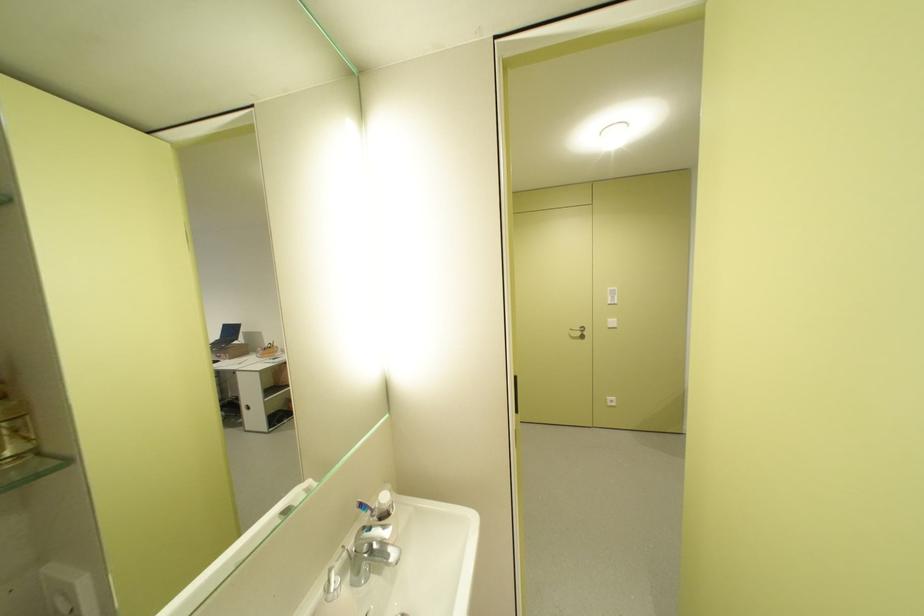
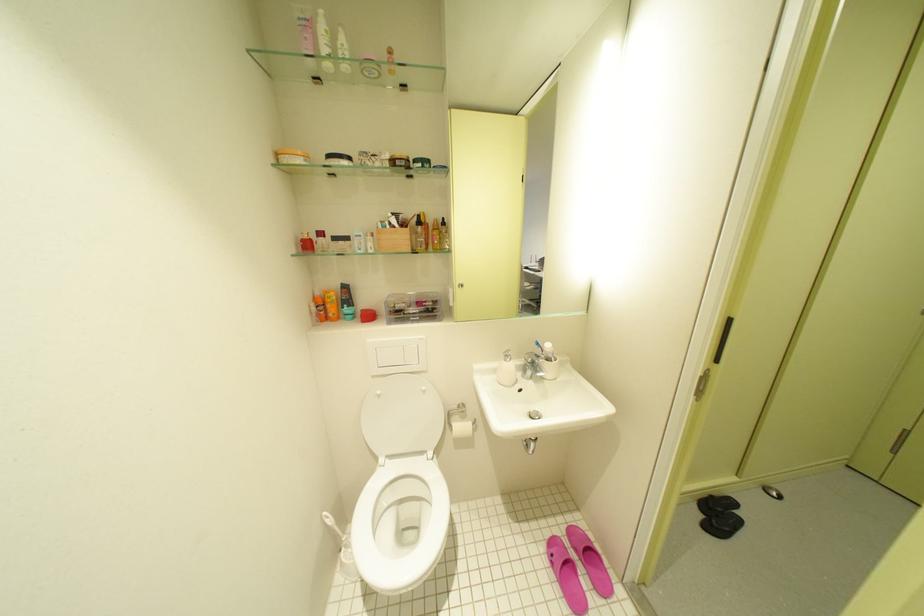
Question: I am providing you with two images of the same scene from different viewpoints. After the viewpoint changes to image2, which objects are now occluded?

Choices:
 (A) sink faucet handle
 (B) toilet paper roll
 (C) golden container
 (D) green apple

Answer: (C)